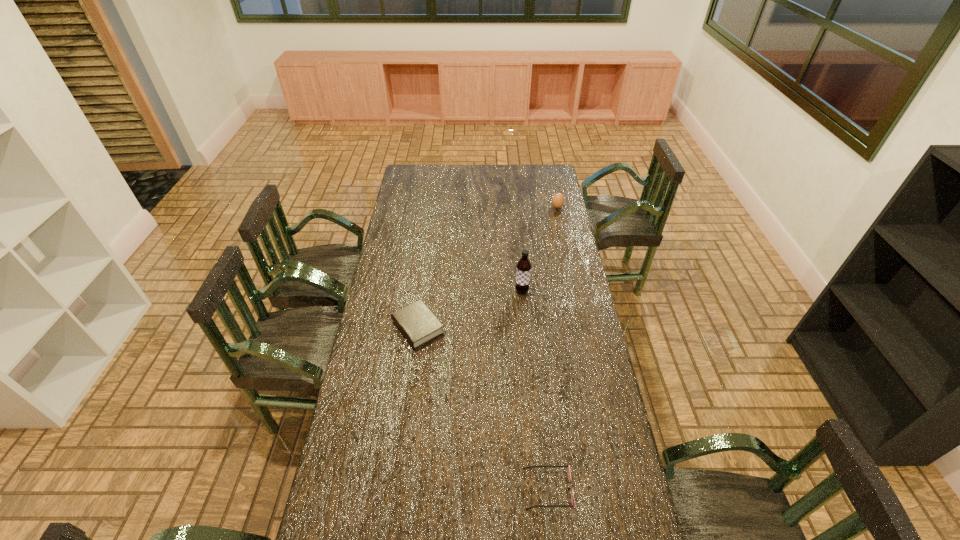
Where is `vacant area that lies between the sunglasses and the Bible`? The image size is (960, 540). vacant area that lies between the sunglasses and the Bible is located at coordinates (483, 408).

Identify the location of free point between the boiled egg and the tallest object. (540, 249).

Locate an element on the screen. Image resolution: width=960 pixels, height=540 pixels. vacant space that is in between the sunglasses and the second nearest object is located at coordinates (483, 408).

Where is `vacant region between the rightmost object and the shortest object`? Image resolution: width=960 pixels, height=540 pixels. vacant region between the rightmost object and the shortest object is located at coordinates (553, 348).

Locate an element on the screen. empty space between the third nearest object and the Bible is located at coordinates (469, 309).

Where is `free space between the third nearest object and the leftmost object`? This screenshot has height=540, width=960. free space between the third nearest object and the leftmost object is located at coordinates (469, 309).

In order to click on empty location between the nearest object and the farthest object in this screenshot , I will do `click(553, 348)`.

Find the location of a particular element. free area in between the nearest object and the tallest object is located at coordinates (535, 390).

You are a GUI agent. You are given a task and a screenshot of the screen. Output one action in this format:
    pyautogui.click(x=<x>, y=<y>)
    Task: Click on the free area in between the shortest object and the root beer
    Image resolution: width=960 pixels, height=540 pixels.
    Given the screenshot: What is the action you would take?
    pyautogui.click(x=535, y=390)

You are a GUI agent. You are given a task and a screenshot of the screen. Output one action in this format:
    pyautogui.click(x=<x>, y=<y>)
    Task: Click on the vacant space in between the shortest object and the boiled egg
    The image size is (960, 540).
    Given the screenshot: What is the action you would take?
    pyautogui.click(x=553, y=348)